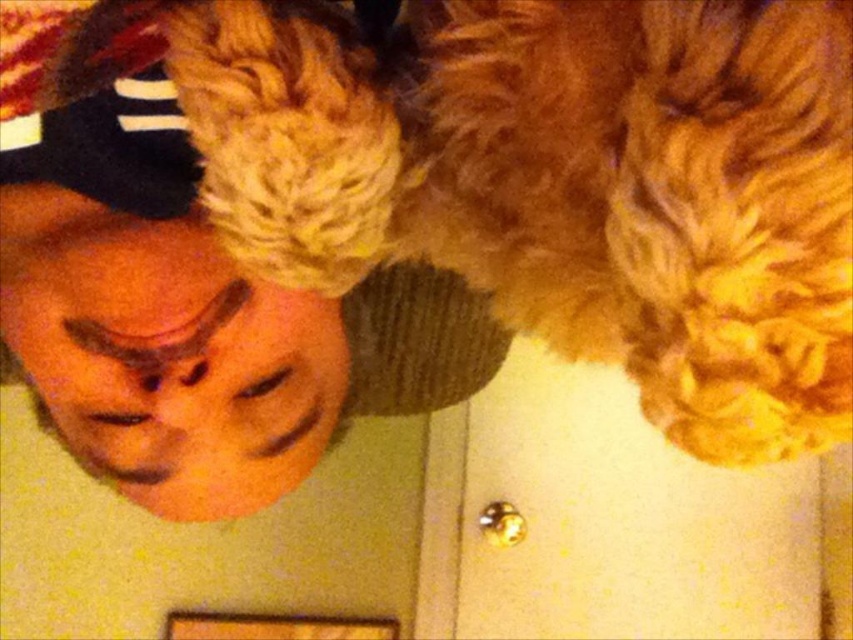
You are a photographer trying to capture a photo of the fuzzy golden cat at upper center and the matte black cap at upper left. Which object should you adjust your camera to focus on first if you want to ensure both are in frame without moving the camera?

The fuzzy golden cat at upper center is to the right of the matte black cap at upper left, so you should focus on the matte black cap at upper left first to ensure both objects remain in frame as you adjust the camera.

You are a photographer setting up a shot of the person and their pet. The camera is positioned to capture both the fuzzy golden cat at upper center and the matte black cap at upper left. Based on their heights, which one will appear larger in the photo?

The matte black cap at upper left appears larger in the photo because it is taller than the fuzzy golden cat at upper center.